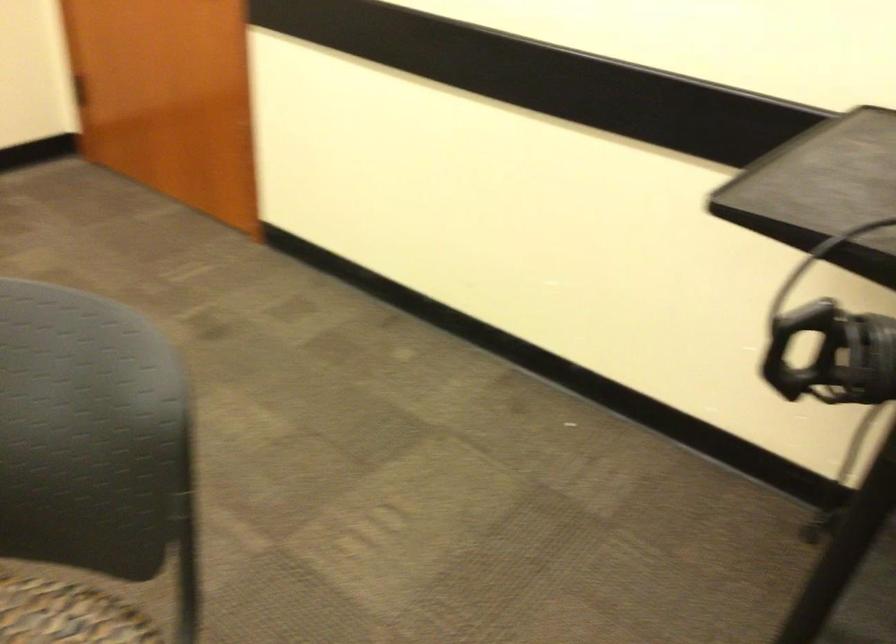
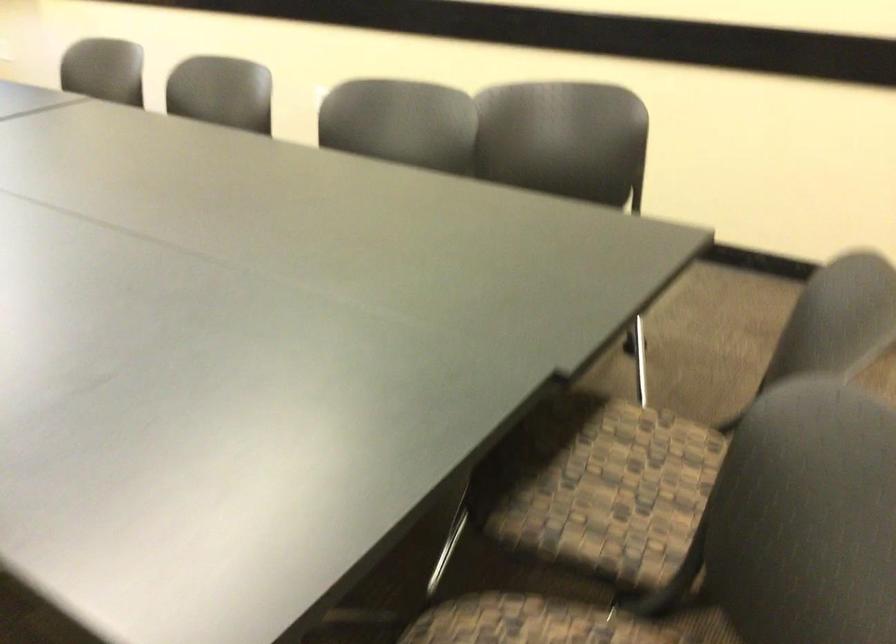
How did the camera likely rotate?

The rotation direction of the camera is left-down.